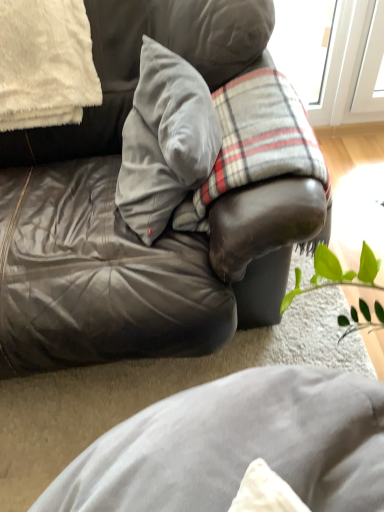
Question: From a real-world perspective, is plaid fabric at center below white fluffy pillow at upper left, arranged as the first pillow when viewed from the left?

Choices:
 (A) no
 (B) yes

Answer: (B)

Question: Could white fluffy pillow at upper left, the second pillow when ordered from right to left, be considered to be inside plaid fabric at center?

Choices:
 (A) yes
 (B) no

Answer: (B)

Question: Are plaid fabric at center and white fluffy pillow at upper left, the second pillow when ordered from right to left, beside each other?

Choices:
 (A) yes
 (B) no

Answer: (B)

Question: From a real-world perspective, is plaid fabric at center over white fluffy pillow at upper left, the second pillow when ordered from right to left?

Choices:
 (A) no
 (B) yes

Answer: (A)

Question: Is white fluffy pillow at upper left, arranged as the first pillow when viewed from the left, at the back of plaid fabric at center?

Choices:
 (A) no
 (B) yes

Answer: (B)

Question: Is white fluffy pillow at upper left, the second pillow when ordered from right to left, spatially inside leather couch at center, or outside of it?

Choices:
 (A) inside
 (B) outside

Answer: (A)

Question: From a real-world perspective, is white fluffy pillow at upper left, the second pillow when ordered from right to left, above or below leather couch at center?

Choices:
 (A) above
 (B) below

Answer: (A)

Question: Is white fluffy pillow at upper left, arranged as the first pillow when viewed from the left, wider or thinner than leather couch at center?

Choices:
 (A) wide
 (B) thin

Answer: (B)

Question: From the image's perspective, relative to leather couch at center, is white fluffy pillow at upper left, arranged as the first pillow when viewed from the left, above or below?

Choices:
 (A) above
 (B) below

Answer: (A)

Question: From a real-world perspective, is plaid fabric at center physically located above or below white fluffy pillow at upper left, the second pillow when ordered from right to left?

Choices:
 (A) below
 (B) above

Answer: (A)

Question: Considering the positions of point (238, 88) and point (87, 82), is point (238, 88) closer or farther from the camera than point (87, 82)?

Choices:
 (A) closer
 (B) farther

Answer: (A)

Question: In terms of size, does plaid fabric at center appear bigger or smaller than white fluffy pillow at upper left, arranged as the first pillow when viewed from the left?

Choices:
 (A) small
 (B) big

Answer: (B)

Question: In terms of width, does plaid fabric at center look wider or thinner when compared to white fluffy pillow at upper left, the second pillow when ordered from right to left?

Choices:
 (A) thin
 (B) wide

Answer: (B)

Question: Considering the relative positions of plaid fabric at center and leather couch at center in the image provided, is plaid fabric at center to the left or to the right of leather couch at center?

Choices:
 (A) right
 (B) left

Answer: (A)

Question: Is plaid fabric at center in front of or behind leather couch at center in the image?

Choices:
 (A) behind
 (B) front

Answer: (A)